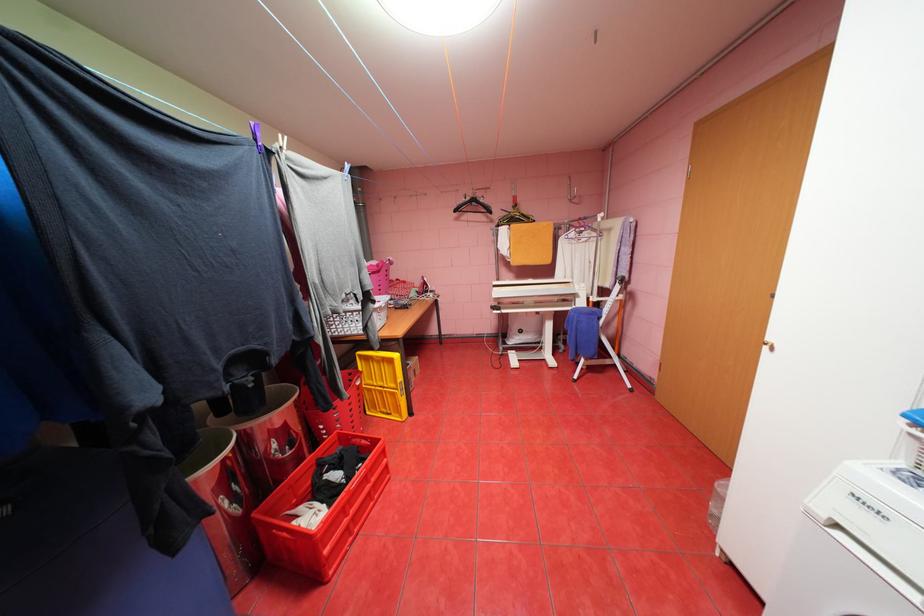
I want to click on white laundry basket, so click(x=322, y=511).